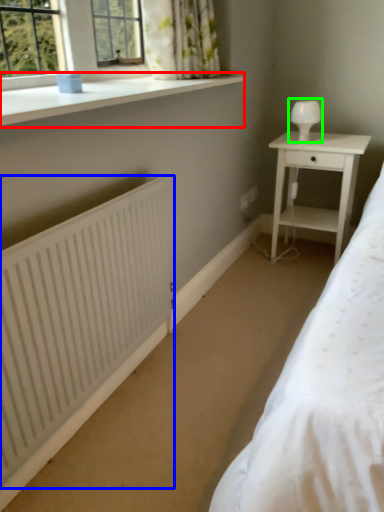
Question: Considering the real-world distances, which object is closest to window sill (highlighted by a red box)? radiator (highlighted by a blue box) or table lamp (highlighted by a green box).

Choices:
 (A) radiator
 (B) table lamp

Answer: (A)